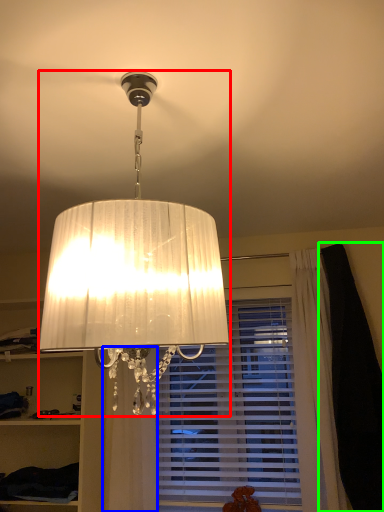
Question: Which object is positioned farthest from lamp (highlighted by a red box)? Select from curtain (highlighted by a blue box) and dark (highlighted by a green box).

Choices:
 (A) curtain
 (B) dark

Answer: (B)